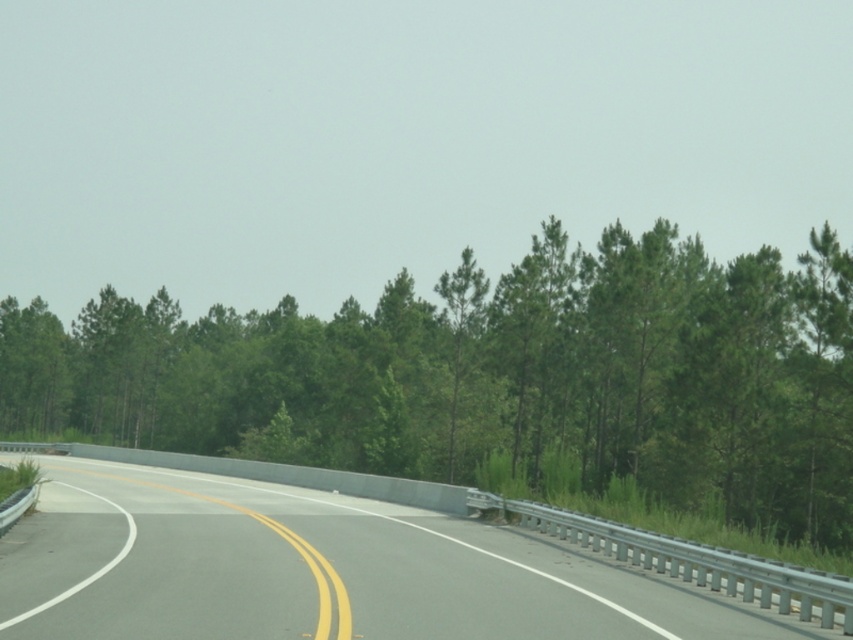
Question: Does green leafy tree at center appear over gray asphalt highway at center?

Choices:
 (A) no
 (B) yes

Answer: (B)

Question: Is green leafy tree at center to the right of gray asphalt highway at center from the viewer's perspective?

Choices:
 (A) yes
 (B) no

Answer: (B)

Question: Which point is closer to the camera taking this photo?

Choices:
 (A) (137, 513)
 (B) (564, 339)

Answer: (A)

Question: Which of the following is the farthest from the observer?

Choices:
 (A) green leafy tree at center
 (B) gray asphalt highway at center

Answer: (A)

Question: Can you confirm if green leafy tree at center is positioned to the right of gray asphalt highway at center?

Choices:
 (A) yes
 (B) no

Answer: (B)